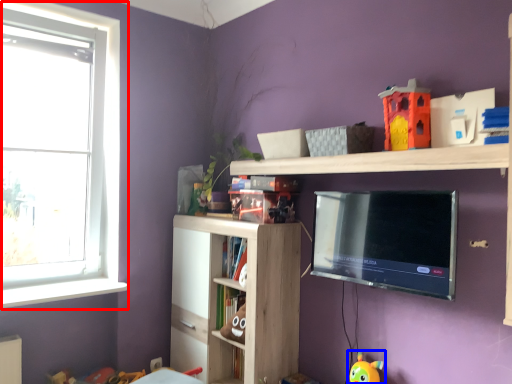
Question: Which object is closer to the camera taking this photo, window (highlighted by a red box) or toy (highlighted by a blue box)?

Choices:
 (A) window
 (B) toy

Answer: (B)